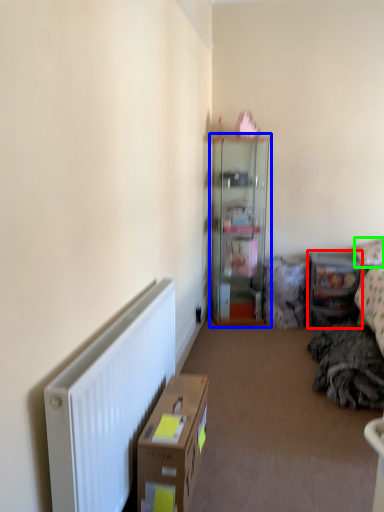
Question: Which object is positioned farthest from shelf (highlighted by a red box)? Select from cabinetry (highlighted by a blue box) and pillow (highlighted by a green box).

Choices:
 (A) cabinetry
 (B) pillow

Answer: (A)